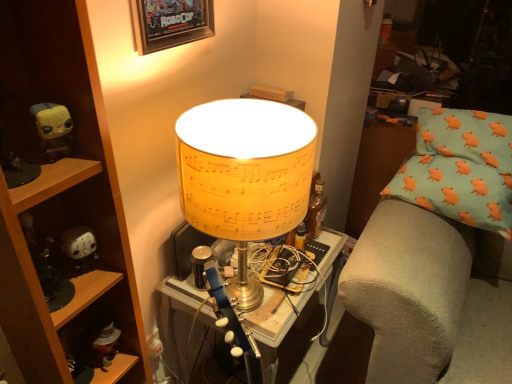
Question: Considering the relative positions of matte yellow lampshade at center and black matte jason voorhees mask at left, the 2th toy viewed from the top, in the image provided, is matte yellow lampshade at center to the left or to the right of black matte jason voorhees mask at left, the 2th toy viewed from the top,?

Choices:
 (A) left
 (B) right

Answer: (B)

Question: In the image, is matte yellow lampshade at center positioned in front of or behind black matte jason voorhees mask at left, the second toy from the front?

Choices:
 (A) behind
 (B) front

Answer: (B)

Question: Which of these objects is positioned farthest from the matte yellow lampshade at center?

Choices:
 (A) wooden shelf at left
 (B) black matte jason voorhees mask at left, the 1th toy when ordered from bottom to top
 (C) yellow matte toy at left, which is the 1th toy from front to back
 (D) wooden framed poster at upper center

Answer: (C)

Question: Which object is the farthest from the wooden shelf at left?

Choices:
 (A) yellow matte toy at left, which is counted as the 2th toy, starting from the bottom
 (B) matte yellow lampshade at center
 (C) black matte jason voorhees mask at left, the 2th toy viewed from the top
 (D) wooden framed poster at upper center

Answer: (D)